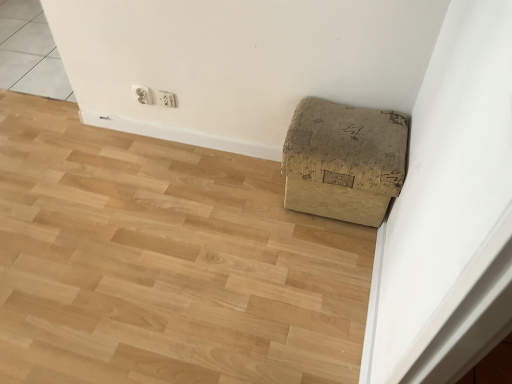
Locate an element on the screen. This screenshot has height=384, width=512. empty space that is ontop of brown cardboard box at lower right is located at coordinates (356, 135).